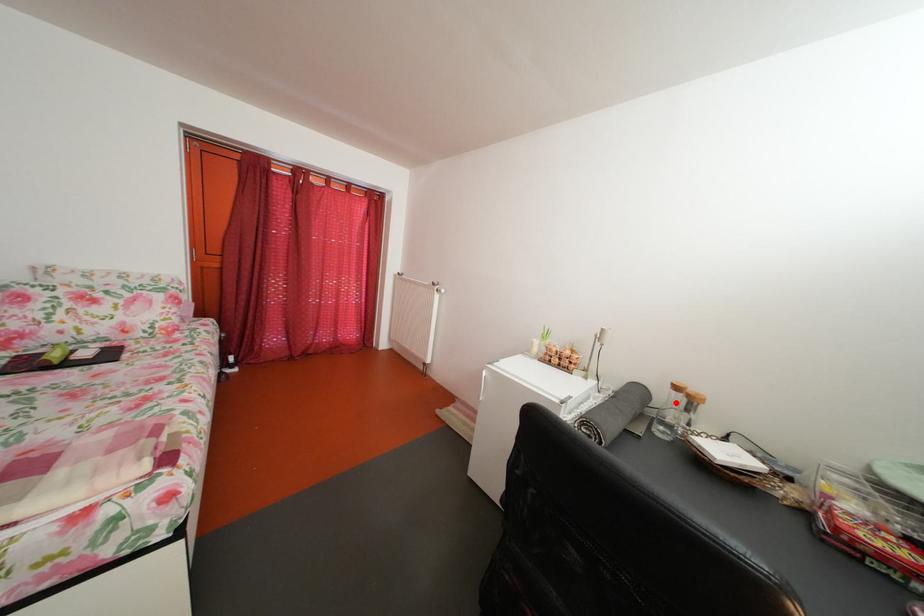
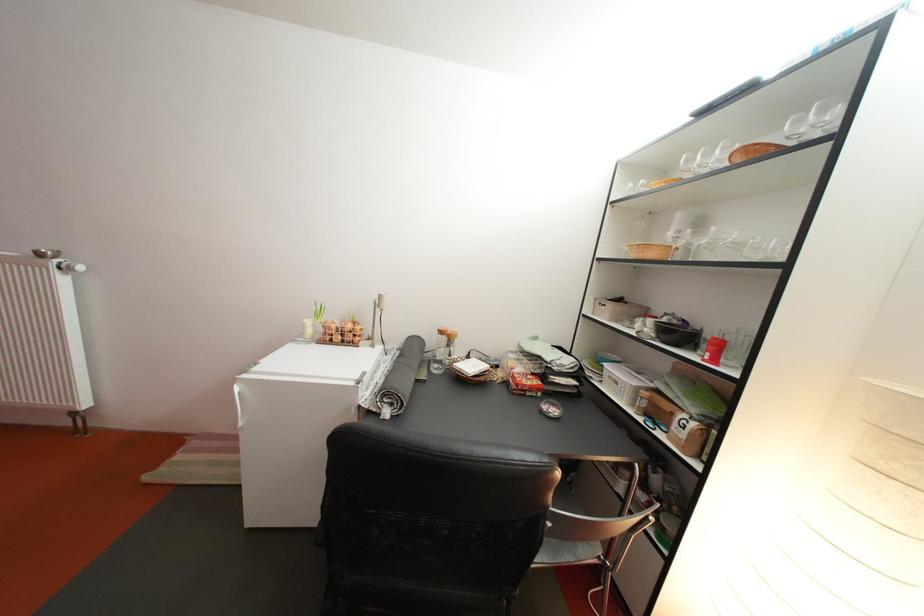
In the second image, find the point that corresponds to the highlighted location in the first image.

(444, 346)